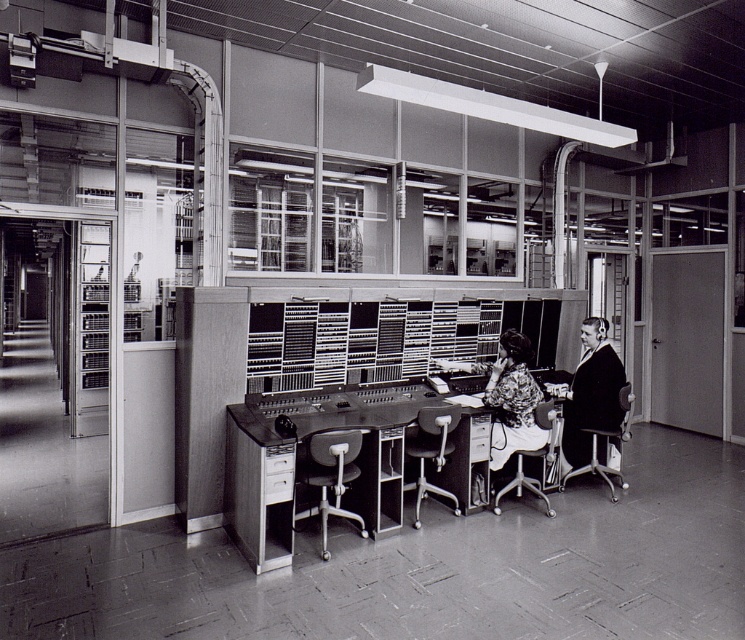
Question: Which object is the closest to the dark wool coat at right?

Choices:
 (A) floral-patterned fabric coat at center
 (B) metallic desk at center

Answer: (A)

Question: Can you confirm if floral-patterned fabric coat at center is positioned above dark wool coat at right?

Choices:
 (A) no
 (B) yes

Answer: (A)

Question: Which of the following is the closest to the observer?

Choices:
 (A) metallic desk at center
 (B) dark wool coat at right
 (C) floral-patterned fabric coat at center

Answer: (A)

Question: Which point is farther from the camera taking this photo?

Choices:
 (A) (402, 500)
 (B) (583, 372)
 (C) (507, 426)

Answer: (B)

Question: Is metallic desk at center smaller than floral-patterned fabric coat at center?

Choices:
 (A) yes
 (B) no

Answer: (B)

Question: From the image, what is the correct spatial relationship of floral-patterned fabric coat at center in relation to dark wool coat at right?

Choices:
 (A) below
 (B) above

Answer: (A)